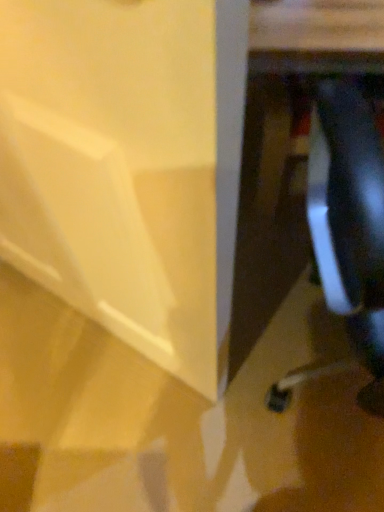
Image resolution: width=384 pixels, height=512 pixels. Describe the element at coordinates (350, 221) in the screenshot. I see `black leather chair at lower right` at that location.

You are a GUI agent. You are given a task and a screenshot of the screen. Output one action in this format:
    pyautogui.click(x=<x>, y=<y>)
    Task: Click on the black leather chair at lower right
    The image size is (384, 512).
    Given the screenshot: What is the action you would take?
    pyautogui.click(x=350, y=221)

Measure the distance between black leather chair at lower right and camera.

16.46 inches.

This screenshot has height=512, width=384. I want to click on black leather chair at lower right, so click(x=350, y=221).